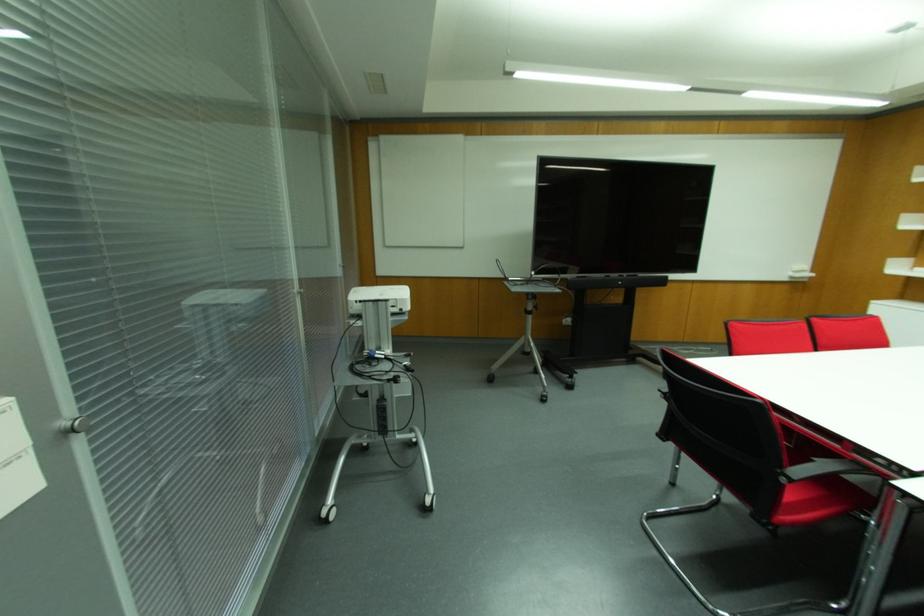
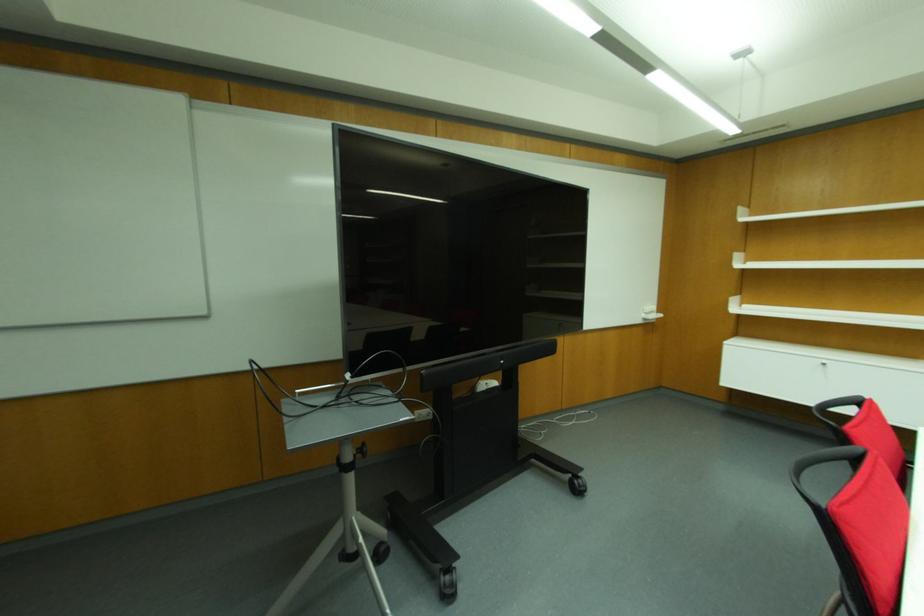
Locate, in the second image, the point that corresponds to point 535,307 in the first image.

(360, 450)